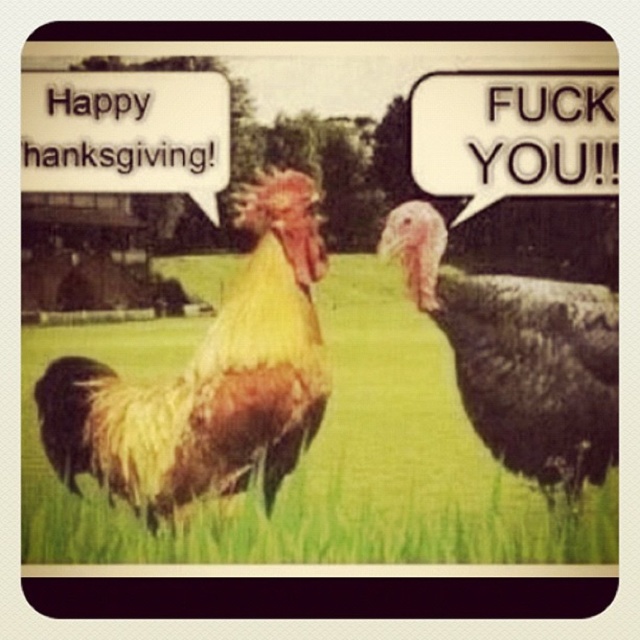
Can you confirm if green grass at center is positioned to the right of golden-yellow feathers at center?

Yes, green grass at center is to the right of golden-yellow feathers at center.

Find the location of a particular element. green grass at center is located at coordinates (323, 456).

Is golden-yellow feathers at center above dark gray matte turkey at right?

Incorrect, golden-yellow feathers at center is not positioned above dark gray matte turkey at right.

Which is in front, point (262, 182) or point (532, 458)?

Point (532, 458)

Which is in front, point (65, 474) or point (586, 372)?

Point (65, 474) is more forward.

Locate an element on the screen. golden-yellow feathers at center is located at coordinates (209, 380).

Who is positioned more to the right, green grass at center or dark gray matte turkey at right?

dark gray matte turkey at right

Which of these two, green grass at center or dark gray matte turkey at right, stands taller?

With more height is dark gray matte turkey at right.

Is point (97, 346) more distant than point (605, 349)?

That is True.

You are a GUI agent. You are given a task and a screenshot of the screen. Output one action in this format:
    pyautogui.click(x=<x>, y=<y>)
    Task: Click on the green grass at center
    This screenshot has width=640, height=640.
    Given the screenshot: What is the action you would take?
    pyautogui.click(x=323, y=456)